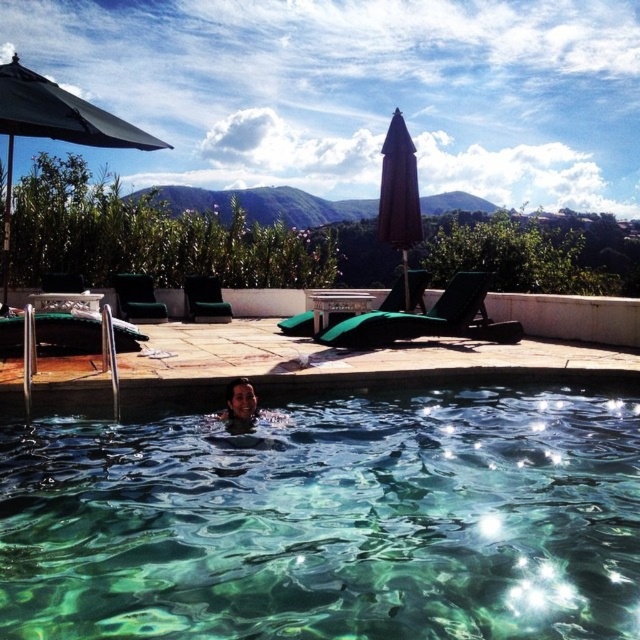
Question: Which of these objects is positioned closest to the brown fabric umbrella at upper center?

Choices:
 (A) clear glass water at center
 (B) matte black hair at lower center
 (C) green fabric umbrella at upper left

Answer: (C)

Question: Does brown fabric umbrella at upper center come in front of matte black hair at lower center?

Choices:
 (A) no
 (B) yes

Answer: (A)

Question: Can you confirm if clear glass water at center is bigger than brown fabric umbrella at upper center?

Choices:
 (A) no
 (B) yes

Answer: (B)

Question: Estimate the real-world distances between objects in this image. Which object is closer to the green fabric umbrella at upper left?

Choices:
 (A) clear glass water at center
 (B) matte black hair at lower center

Answer: (B)

Question: Which of the following is the farthest from the observer?

Choices:
 (A) (388, 202)
 (B) (211, 499)
 (C) (52, 90)

Answer: (A)

Question: Can you confirm if brown fabric umbrella at upper center is positioned above matte black hair at lower center?

Choices:
 (A) no
 (B) yes

Answer: (B)